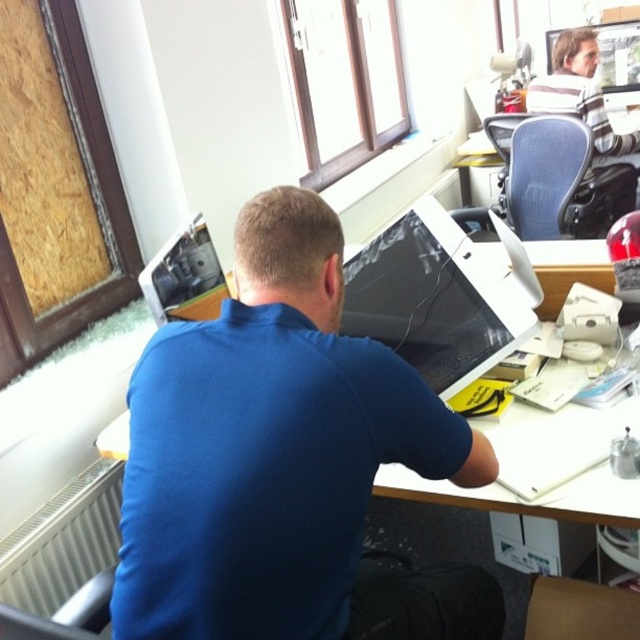
Is point (204, 332) closer to viewer compared to point (180, 257)?

Yes.

Is point (368, 353) closer to viewer compared to point (182, 308)?

Yes, point (368, 353) is closer to viewer.

Where is `blue matte shirt at center`? blue matte shirt at center is located at coordinates [x=284, y=461].

Does matte black monitor at center appear on the left side of matte black monitor at upper left?

Incorrect, matte black monitor at center is not on the left side of matte black monitor at upper left.

What do you see at coordinates (428, 300) in the screenshot? I see `matte black monitor at center` at bounding box center [428, 300].

This screenshot has width=640, height=640. Identify the location of matte black monitor at center. (428, 300).

Is point (547, 84) in front of point (176, 257)?

No, it is not.

Is striped cotton shirt at upper right to the right of matte black monitor at upper left from the viewer's perspective?

Correct, you'll find striped cotton shirt at upper right to the right of matte black monitor at upper left.

Is point (595, 113) farther from viewer compared to point (154, 273)?

Yes, point (595, 113) is farther from viewer.

Identify the location of striped cotton shirt at upper right. (580, 93).